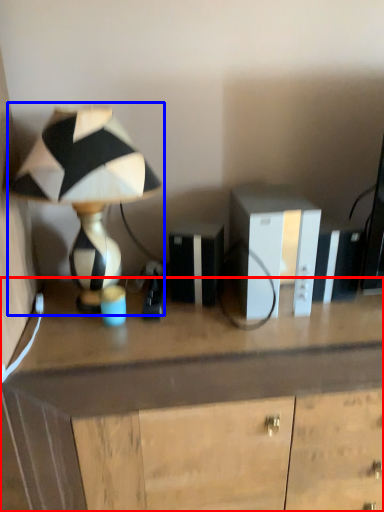
Question: Which object is further to the camera taking this photo, desk (highlighted by a red box) or lamp (highlighted by a blue box)?

Choices:
 (A) desk
 (B) lamp

Answer: (A)